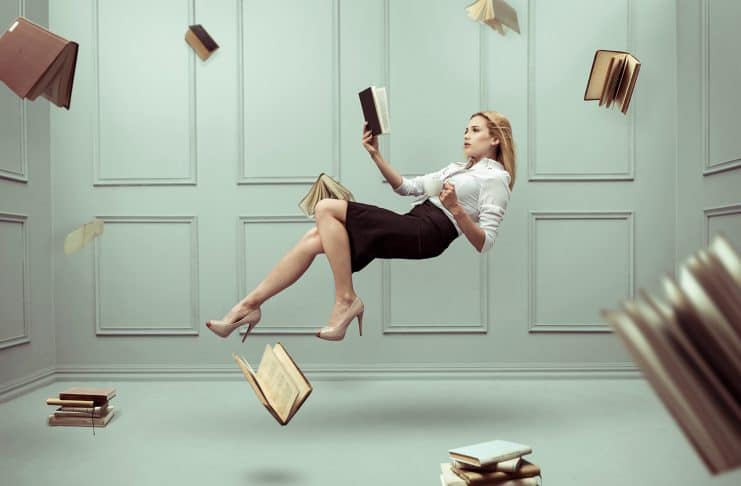
Locate an element on the screen. wall panels is located at coordinates coord(147,88), coord(293,94), coord(430,84), coord(570,112), coord(591,257), coord(445,285), coord(265,250), coord(141,271).